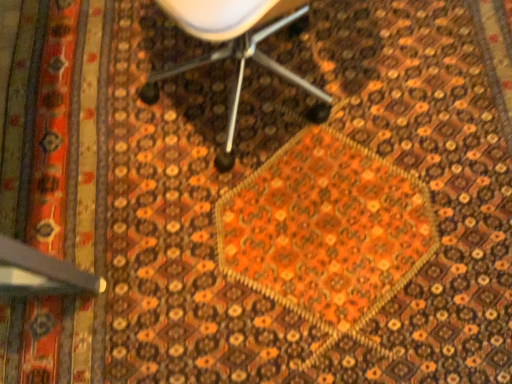
What do you see at coordinates (237, 52) in the screenshot?
I see `white plastic chair at center` at bounding box center [237, 52].

At what (x,y) coordinates should I click in order to perform the action: click on white plastic chair at center. Please return your answer as a coordinate pair (x, y). Looking at the image, I should click on (237, 52).

Identify the location of white plastic chair at center. Image resolution: width=512 pixels, height=384 pixels. (237, 52).